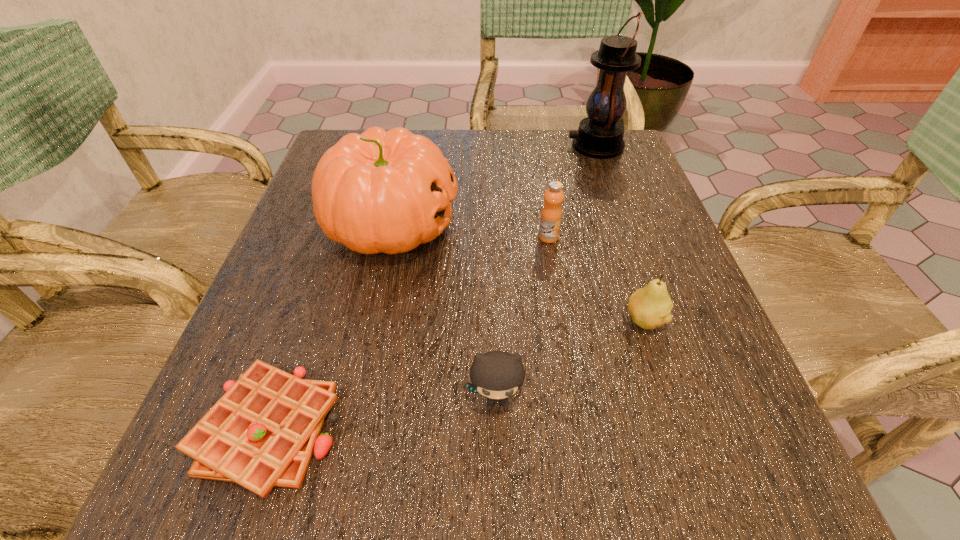
Find the location of a particular element. free space located on the carved face of the pumpkin is located at coordinates [x=657, y=224].

Locate an element on the screen. This screenshot has width=960, height=540. vacant space located on the front label of the third object from right to left is located at coordinates (556, 282).

This screenshot has width=960, height=540. Identify the location of vacant space located on the back of the pear. (619, 245).

Where is `free location located 0.050m on the front-facing side of the kitten`? free location located 0.050m on the front-facing side of the kitten is located at coordinates (497, 457).

You are a GUI agent. You are given a task and a screenshot of the screen. Output one action in this format:
    pyautogui.click(x=<x>, y=<y>)
    Task: Click on the vacant area located 0.060m on the back of the waffle
    
    Given the screenshot: What is the action you would take?
    pyautogui.click(x=300, y=336)

Identify the location of object that is at the far edge. coord(600,135).

Identify the location of object positioned at the near edge. This screenshot has height=540, width=960. (262, 432).

This screenshot has height=540, width=960. In order to click on pumpkin that is at the left edge in this screenshot , I will do `click(380, 191)`.

At what (x,y) coordinates should I click in order to perform the action: click on waffle positioned at the left edge. Please return your answer as a coordinate pair (x, y). The image size is (960, 540). Looking at the image, I should click on (262, 432).

Locate an element on the screen. lantern present at the right edge is located at coordinates (600, 135).